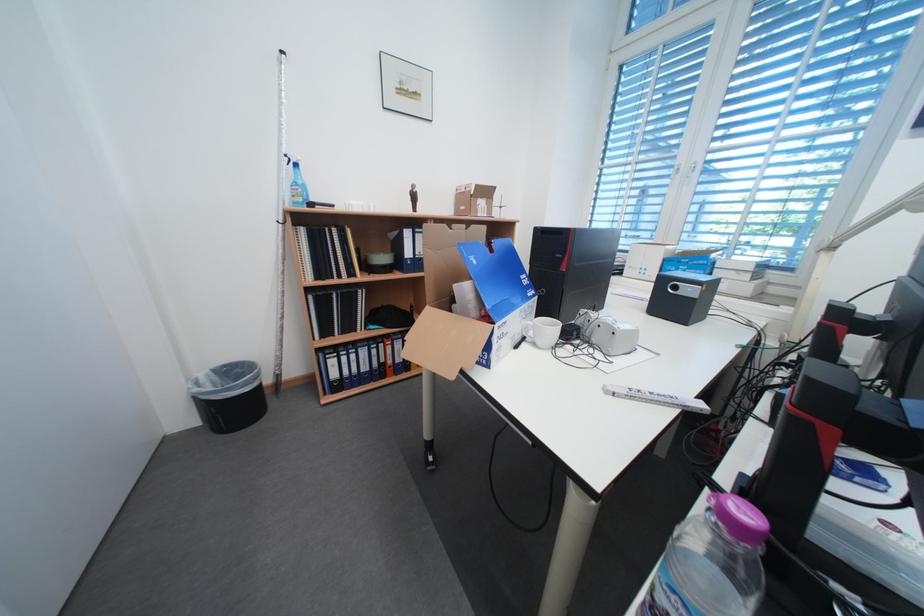
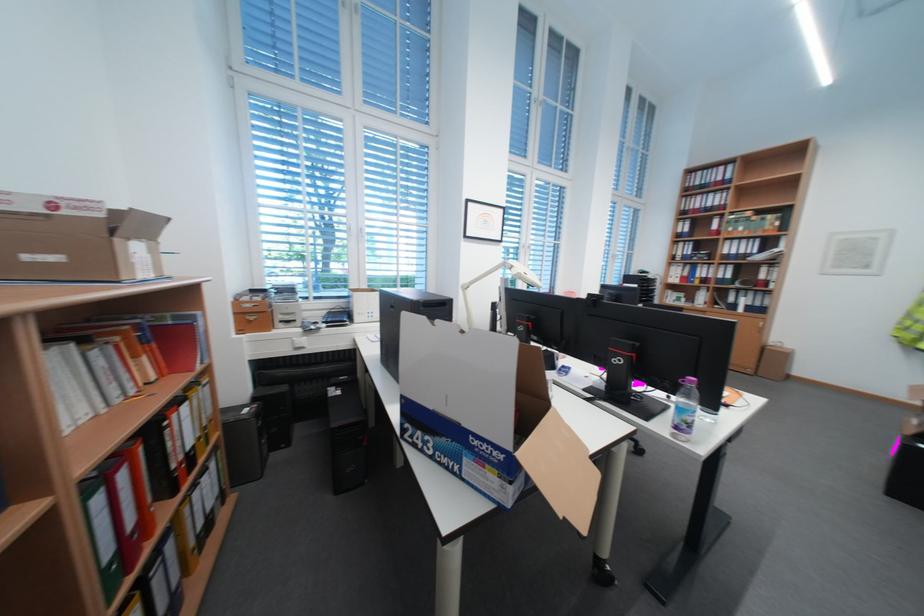
The point at [492,204] is marked in the first image. Where is the corresponding point in the second image?

(148, 249)